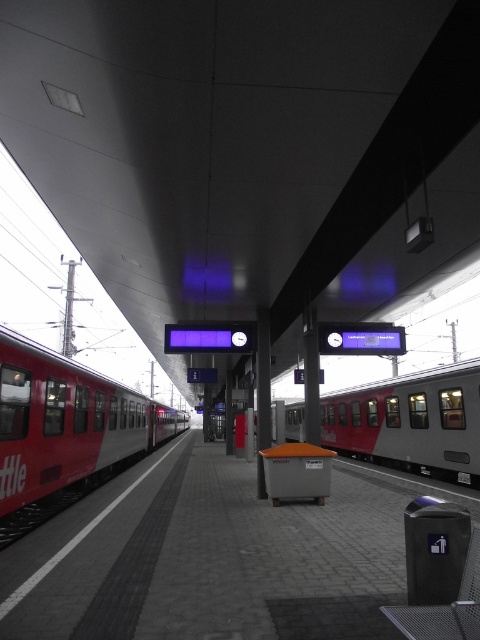
Question: Which point appears closest to the camera in this image?

Choices:
 (A) (122, 451)
 (B) (379, 408)

Answer: (A)

Question: Is red matte train at left to the right of silver metallic train at center from the viewer's perspective?

Choices:
 (A) yes
 (B) no

Answer: (B)

Question: Does red matte train at left appear over silver metallic train at center?

Choices:
 (A) yes
 (B) no

Answer: (A)

Question: Considering the relative positions of red matte train at left and silver metallic train at center in the image provided, where is red matte train at left located with respect to silver metallic train at center?

Choices:
 (A) left
 (B) right

Answer: (A)